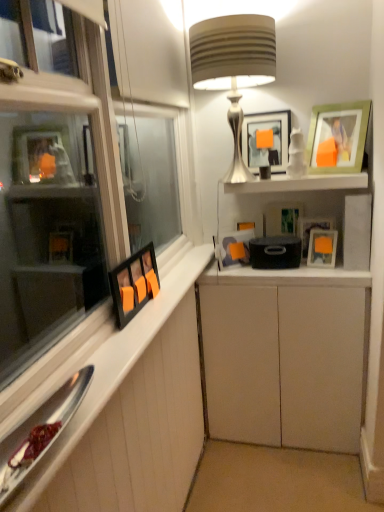
Image resolution: width=384 pixels, height=512 pixels. Describe the element at coordinates (233, 244) in the screenshot. I see `matte black picture frame at upper right, which is the 2th picture frame in left-to-right order` at that location.

Measure the distance between matte black picture frame at upper right, arranged as the 2th picture frame when viewed from the right, and camera.

matte black picture frame at upper right, arranged as the 2th picture frame when viewed from the right, and camera are 6.31 feet apart.

Describe the element at coordinates (339, 136) in the screenshot. I see `green matte picture frame at upper right, the first picture frame positioned from the right` at that location.

How much space does matte black picture frame at upper center, the 5th picture frame from the right, occupy vertically?

matte black picture frame at upper center, the 5th picture frame from the right, is 11.71 inches in height.

The image size is (384, 512). I want to click on satin silver lamp at upper center, so click(233, 67).

I want to click on matte black picture frame at upper right, which is counted as the 6th picture frame, starting from the right, so click(233, 244).

Which is correct: satin silver lamp at upper center is inside matte black picture frame at left, which ranks as the 7th picture frame in right-to-left order, or outside of it?

satin silver lamp at upper center is not inside matte black picture frame at left, which ranks as the 7th picture frame in right-to-left order, it's outside.

Does point (231, 37) come in front of point (154, 283)?

No.

From a real-world perspective, which is physically above, satin silver lamp at upper center or matte black picture frame at left, placed as the first picture frame when sorted from left to right?

satin silver lamp at upper center.

Would you say satin silver lamp at upper center is a long distance from matte black picture frame at left, which ranks as the 7th picture frame in right-to-left order?

No, satin silver lamp at upper center is not far away from matte black picture frame at left, which ranks as the 7th picture frame in right-to-left order.

Does matte black picture frame at upper right, which is counted as the 6th picture frame, starting from the right, have a smaller size compared to green matte picture frame at upper right, the first picture frame positioned from the right?

Yes.

Is matte black picture frame at upper right, which is counted as the 6th picture frame, starting from the right, far away from green matte picture frame at upper right, the first picture frame positioned from the right?

They are positioned close to each other.

Can you tell me how much matte black picture frame at upper right, which is the 2th picture frame in left-to-right order, and green matte picture frame at upper right, the first picture frame positioned from the right, differ in facing direction?

They differ by 65.8 degrees in their facing directions.

Is matte black picture frame at upper right, which is counted as the 6th picture frame, starting from the right, closer to the viewer compared to green matte picture frame at upper right, the seventh picture frame positioned from the left?

No, it is not.

Considering the relative sizes of satin silver lamp at upper center and white wood cabinet at left, placed as the 1th cabinetry when sorted from left to right, in the image provided, is satin silver lamp at upper center shorter than white wood cabinet at left, placed as the 1th cabinetry when sorted from left to right,?

No.

From the image's perspective, is satin silver lamp at upper center beneath white wood cabinet at left, which is the second cabinetry from right to left?

No.

Find the location of a particular element. The image size is (384, 512). cabinetry that is the 1st one below the satin silver lamp at upper center (from a real-world perspective) is located at coordinates (133, 413).

Is white glossy picture frame at center-right, placed as the 5th picture frame when sorted from left to right, to the right of white matte cabinet at center, positioned as the first cabinetry in right-to-left order, from the viewer's perspective?

Yes, white glossy picture frame at center-right, placed as the 5th picture frame when sorted from left to right, is to the right of white matte cabinet at center, positioned as the first cabinetry in right-to-left order.

From the image's perspective, which is below, white glossy picture frame at center-right, the 3th picture frame when ordered from right to left, or white matte cabinet at center, the 2th cabinetry in the left-to-right sequence?

white matte cabinet at center, the 2th cabinetry in the left-to-right sequence, appears lower in the image.

Which of these two, white glossy picture frame at center-right, the 3th picture frame when ordered from right to left, or white matte cabinet at center, the 2th cabinetry in the left-to-right sequence, is bigger?

white matte cabinet at center, the 2th cabinetry in the left-to-right sequence.

From a real-world perspective, is white glossy picture frame at center-right, the 3th picture frame when ordered from right to left, on top of white matte cabinet at center, the 2th cabinetry in the left-to-right sequence?

Yes.

Which object is further away from the camera taking this photo, white glossy cabinet at upper center or matte black picture frame at upper right, which is the 2th picture frame in left-to-right order?

matte black picture frame at upper right, which is the 2th picture frame in left-to-right order, is further from the camera.

Is white glossy cabinet at upper center to the left of matte black picture frame at upper right, which is the 2th picture frame in left-to-right order, from the viewer's perspective?

No, white glossy cabinet at upper center is not to the left of matte black picture frame at upper right, which is the 2th picture frame in left-to-right order.

From the image's perspective, count 4th picture frames downward from the white glossy cabinet at upper center and point to it. Please provide its 2D coordinates.

[(233, 244)]

From a real-world perspective, between white glossy cabinet at upper center and matte black picture frame at upper right, which is counted as the 6th picture frame, starting from the right, who is vertically lower?

matte black picture frame at upper right, which is counted as the 6th picture frame, starting from the right, from a real-world perspective.

From a real-world perspective, is matte black picture frame at upper right, which is the 2th picture frame in left-to-right order, positioned under matte black picture frame at upper right, the sixth picture frame when ordered from left to right, based on gravity?

Yes, from a real-world perspective, matte black picture frame at upper right, which is the 2th picture frame in left-to-right order, is under matte black picture frame at upper right, the sixth picture frame when ordered from left to right.

Between matte black picture frame at upper right, which is counted as the 6th picture frame, starting from the right, and matte black picture frame at upper right, arranged as the 2th picture frame when viewed from the right, which one appears on the left side from the viewer's perspective?

From the viewer's perspective, matte black picture frame at upper right, which is counted as the 6th picture frame, starting from the right, appears more on the left side.

Is matte black picture frame at upper right, arranged as the 2th picture frame when viewed from the right, located within matte black picture frame at upper right, which is the 2th picture frame in left-to-right order?

Definitely not — matte black picture frame at upper right, arranged as the 2th picture frame when viewed from the right, is not inside matte black picture frame at upper right, which is the 2th picture frame in left-to-right order.

Between white matte cabinet at center, the 2th cabinetry in the left-to-right sequence, and white glossy cabinet at upper center, which one has smaller width?

white glossy cabinet at upper center.

Is white matte cabinet at center, positioned as the first cabinetry in right-to-left order, completely or partially outside of white glossy cabinet at upper center?

That's correct, white matte cabinet at center, positioned as the first cabinetry in right-to-left order, is outside of white glossy cabinet at upper center.

Does point (265, 411) come behind point (274, 187)?

Yes, point (265, 411) is behind point (274, 187).

Is white matte cabinet at center, the 2th cabinetry in the left-to-right sequence, taller than white glossy cabinet at upper center?

Indeed, white matte cabinet at center, the 2th cabinetry in the left-to-right sequence, has a greater height compared to white glossy cabinet at upper center.

Where is `table lamp behind the matte black picture frame at left, placed as the first picture frame when sorted from left to right`? table lamp behind the matte black picture frame at left, placed as the first picture frame when sorted from left to right is located at coordinates (233, 67).

At what (x,y) coordinates should I click in order to perform the action: click on the 5th picture frame located beneath the green matte picture frame at upper right, the first picture frame positioned from the right (from a real-world perspective). Please return your answer as a coordinate pair (x, y). The image size is (384, 512). Looking at the image, I should click on (233, 244).

Considering their positions, is satin silver lamp at upper center positioned closer to white glossy picture frame at center-right, placed as the 5th picture frame when sorted from left to right, than white wood cabinet at left, which is the second cabinetry from right to left?

satin silver lamp at upper center.

From the picture: Estimate the real-world distances between objects in this image. Which object is further from white matte cabinet at center, the 2th cabinetry in the left-to-right sequence, matte black picture frame at center, which is the 4th picture frame from left to right, or white wood cabinet at left, which is the second cabinetry from right to left?

matte black picture frame at center, which is the 4th picture frame from left to right, is further to white matte cabinet at center, the 2th cabinetry in the left-to-right sequence.

Considering their positions, is white wood cabinet at left, which is the second cabinetry from right to left, positioned further to matte black picture frame at left, which ranks as the 7th picture frame in right-to-left order, than satin silver lamp at upper center?

satin silver lamp at upper center lies further to matte black picture frame at left, which ranks as the 7th picture frame in right-to-left order, than the other object.

When comparing their distances from white matte cabinet at center, positioned as the first cabinetry in right-to-left order, does matte black picture frame at upper right, the sixth picture frame when ordered from left to right, or white glossy cabinet at upper center seem closer?

Among the two, matte black picture frame at upper right, the sixth picture frame when ordered from left to right, is located nearer to white matte cabinet at center, positioned as the first cabinetry in right-to-left order.

From the image, which object appears to be farther from matte black picture frame at center, which is the 4th picture frame from left to right, white glossy picture frame at center-right, the 3th picture frame when ordered from right to left, or green matte picture frame at upper right, the first picture frame positioned from the right?

The object further to matte black picture frame at center, which is the 4th picture frame from left to right, is green matte picture frame at upper right, the first picture frame positioned from the right.

Looking at the image, which one is located closer to satin silver lamp at upper center, matte black picture frame at upper right, the sixth picture frame when ordered from left to right, or green matte picture frame at upper right, the seventh picture frame positioned from the left?

The object closer to satin silver lamp at upper center is green matte picture frame at upper right, the seventh picture frame positioned from the left.

Considering their positions, is white matte cabinet at center, the 2th cabinetry in the left-to-right sequence, positioned further to white glossy picture frame at center-right, the 3th picture frame when ordered from right to left, than satin silver lamp at upper center?

satin silver lamp at upper center lies further to white glossy picture frame at center-right, the 3th picture frame when ordered from right to left, than the other object.

Based on their spatial positions, is white glossy cabinet at upper center or matte black picture frame at upper right, which is the 2th picture frame in left-to-right order, further from matte black picture frame at left, placed as the first picture frame when sorted from left to right?

white glossy cabinet at upper center lies further to matte black picture frame at left, placed as the first picture frame when sorted from left to right, than the other object.

Where is `cabinet between matte black picture frame at upper center, the 5th picture frame from the right, and matte black picture frame at upper right, arranged as the 2th picture frame when viewed from the right, in the vertical direction`? The height and width of the screenshot is (512, 384). cabinet between matte black picture frame at upper center, the 5th picture frame from the right, and matte black picture frame at upper right, arranged as the 2th picture frame when viewed from the right, in the vertical direction is located at coordinates (299, 183).

Identify the location of cabinet that lies between matte black picture frame at upper center, the 3th picture frame positioned from the left, and white matte cabinet at center, positioned as the first cabinetry in right-to-left order, from top to bottom. (299, 183).

The height and width of the screenshot is (512, 384). I want to click on cabinet between matte black picture frame at upper right, which is counted as the 6th picture frame, starting from the right, and white glossy picture frame at center-right, placed as the 5th picture frame when sorted from left to right, in the horizontal direction, so click(x=299, y=183).

Locate an element on the screen. The width and height of the screenshot is (384, 512). cabinetry between white wood cabinet at left, which is the second cabinetry from right to left, and matte black picture frame at center, which is the 4th picture frame from left to right, from front to back is located at coordinates (284, 356).